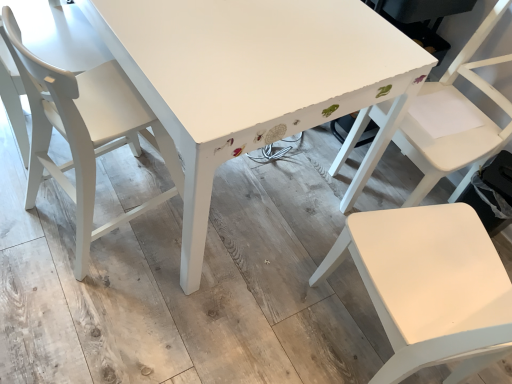
What is the approximate height of white painted wood table at center?

It is 30.33 inches.

Measure the distance between point (42, 66) and camera.

Point (42, 66) is 1.02 meters away from camera.

What do you see at coordinates (85, 130) in the screenshot?
I see `matte white chair at left, positioned as the third chair in right-to-left order` at bounding box center [85, 130].

This screenshot has height=384, width=512. Find the location of `white matte chair at right, the 2th chair when ordered from right to left`. white matte chair at right, the 2th chair when ordered from right to left is located at coordinates (430, 286).

Describe the element at coordinates (430, 286) in the screenshot. I see `white matte chair at right, the 2th chair when ordered from right to left` at that location.

The image size is (512, 384). I want to click on white painted wood table at center, so click(x=253, y=79).

Is point (484, 281) positioned behind point (207, 1)?

No, it is not.

Image resolution: width=512 pixels, height=384 pixels. Find the location of `chair that is the 3rd object located below the white painted wood table at center (from the image's perspective)`. chair that is the 3rd object located below the white painted wood table at center (from the image's perspective) is located at coordinates (430, 286).

Is white matte chair at right, the 2th chair when ordered from right to left, inside or outside of white painted wood table at center?

white matte chair at right, the 2th chair when ordered from right to left, exists outside the volume of white painted wood table at center.

From a real-world perspective, between white matte chair at right, the 2th chair when ordered from right to left, and white painted wood table at center, who is vertically lower?

From a 3D spatial view, white painted wood table at center is below.

From a real-world perspective, which is physically above, matte white chair at left, positioned as the third chair in right-to-left order, or white matte chair at right, marked as the 2th chair in a left-to-right arrangement?

In real-world perspective, white matte chair at right, marked as the 2th chair in a left-to-right arrangement, is above.

Choose the correct answer: Is matte white chair at left, positioned as the third chair in right-to-left order, inside white matte chair at right, marked as the 2th chair in a left-to-right arrangement, or outside it?

matte white chair at left, positioned as the third chair in right-to-left order, is located beyond the bounds of white matte chair at right, marked as the 2th chair in a left-to-right arrangement.

Is matte white chair at left, which is the 1th chair from left to right, in front of or behind white matte chair at right, marked as the 2th chair in a left-to-right arrangement, in the image?

In the image, matte white chair at left, which is the 1th chair from left to right, appears behind white matte chair at right, marked as the 2th chair in a left-to-right arrangement.

Which of these two, matte white chair at left, which is the 1th chair from left to right, or white matte chair at right, the 2th chair when ordered from right to left, is wider?

With larger width is white matte chair at right, the 2th chair when ordered from right to left.

Is white painted wood table at center wider than white matte chair at right, the 2th chair when ordered from right to left?

Correct, the width of white painted wood table at center exceeds that of white matte chair at right, the 2th chair when ordered from right to left.

Is white painted wood table at center oriented towards white matte chair at right, marked as the 2th chair in a left-to-right arrangement?

No, white painted wood table at center is not facing towards white matte chair at right, marked as the 2th chair in a left-to-right arrangement.

Considering the positions of objects white painted wood table at center and white matte chair at right, the 2th chair when ordered from right to left, in the image provided, who is more to the right, white painted wood table at center or white matte chair at right, the 2th chair when ordered from right to left,?

white matte chair at right, the 2th chair when ordered from right to left.

Is white matte chair at right, marked as the 2th chair in a left-to-right arrangement, surrounded by white painted wood table at center?

No, white matte chair at right, marked as the 2th chair in a left-to-right arrangement, is not surrounded by white painted wood table at center.

Considering the relative sizes of white matte chair at center, which is counted as the 3th chair, starting from the left, and white matte chair at right, marked as the 2th chair in a left-to-right arrangement, in the image provided, is white matte chair at center, which is counted as the 3th chair, starting from the left, wider than white matte chair at right, marked as the 2th chair in a left-to-right arrangement,?

No, white matte chair at center, which is counted as the 3th chair, starting from the left, is not wider than white matte chair at right, marked as the 2th chair in a left-to-right arrangement.

Does point (481, 121) appear closer or farther from the camera than point (371, 213)?

Point (481, 121) appears to be farther away from the viewer than point (371, 213).

What's the angular difference between white matte chair at center, the 1th chair when ordered from right to left, and white matte chair at right, marked as the 2th chair in a left-to-right arrangement,'s facing directions?

white matte chair at center, the 1th chair when ordered from right to left, and white matte chair at right, marked as the 2th chair in a left-to-right arrangement, are facing 106 degrees away from each other.

Does white matte chair at center, the 1th chair when ordered from right to left, appear on the left side of white matte chair at right, the 2th chair when ordered from right to left?

In fact, white matte chair at center, the 1th chair when ordered from right to left, is to the right of white matte chair at right, the 2th chair when ordered from right to left.

Is matte white chair at left, positioned as the third chair in right-to-left order, to the right of white painted wood table at center from the viewer's perspective?

Incorrect, matte white chair at left, positioned as the third chair in right-to-left order, is not on the right side of white painted wood table at center.

From a real-world perspective, between matte white chair at left, which is the 1th chair from left to right, and white painted wood table at center, who is vertically higher?

matte white chair at left, which is the 1th chair from left to right, is physically above.

Can we say matte white chair at left, which is the 1th chair from left to right, lies outside white painted wood table at center?

No, matte white chair at left, which is the 1th chair from left to right, is not outside of white painted wood table at center.

Does matte white chair at left, which is the 1th chair from left to right, have a lesser height compared to white painted wood table at center?

No.

Is white matte chair at center, the 1th chair when ordered from right to left, located outside matte white chair at left, which is the 1th chair from left to right?

Yes, white matte chair at center, the 1th chair when ordered from right to left, is outside of matte white chair at left, which is the 1th chair from left to right.

Based on the photo, is white matte chair at center, which is counted as the 3th chair, starting from the left, to the right of matte white chair at left, positioned as the third chair in right-to-left order, from the viewer's perspective?

Yes.

Is white matte chair at center, the 1th chair when ordered from right to left, facing away from matte white chair at left, positioned as the third chair in right-to-left order?

No, white matte chair at center, the 1th chair when ordered from right to left, is not facing away from matte white chair at left, positioned as the third chair in right-to-left order.

From the image's perspective, which is below, white matte chair at center, which is counted as the 3th chair, starting from the left, or matte white chair at left, which is the 1th chair from left to right?

matte white chair at left, which is the 1th chair from left to right, from the image's perspective.

Considering the points (332, 118) and (14, 52), which point is in front, point (332, 118) or point (14, 52)?

The point (14, 52) is closer to the camera.

Which object is positioned more to the right, white painted wood table at center or matte white chair at left, positioned as the third chair in right-to-left order?

white painted wood table at center.

Is matte white chair at left, positioned as the third chair in right-to-left order, surrounded by white painted wood table at center?

Yes, matte white chair at left, positioned as the third chair in right-to-left order, is surrounded by white painted wood table at center.

From a real-world perspective, is white painted wood table at center physically above matte white chair at left, which is the 1th chair from left to right?

Incorrect, from a real-world perspective, white painted wood table at center is lower than matte white chair at left, which is the 1th chair from left to right.

Identify the location of chair that is the 3rd one when counting downward from the white painted wood table at center (from the image's perspective). This screenshot has width=512, height=384. (430, 286).

The height and width of the screenshot is (384, 512). Find the location of `the 2nd chair positioned above the matte white chair at left, which is the 1th chair from left to right (from a real-world perspective)`. the 2nd chair positioned above the matte white chair at left, which is the 1th chair from left to right (from a real-world perspective) is located at coordinates (430, 286).

When comparing their distances from white painted wood table at center, does white matte chair at right, the 2th chair when ordered from right to left, or matte white chair at left, positioned as the third chair in right-to-left order, seem further?

white matte chair at right, the 2th chair when ordered from right to left, is further to white painted wood table at center.

From the image, which object appears to be farther from white painted wood table at center, white matte chair at center, which is counted as the 3th chair, starting from the left, or matte white chair at left, positioned as the third chair in right-to-left order?

white matte chair at center, which is counted as the 3th chair, starting from the left, is further to white painted wood table at center.

Which object lies further to the anchor point white matte chair at center, which is counted as the 3th chair, starting from the left, white matte chair at right, the 2th chair when ordered from right to left, or white painted wood table at center?

The object further to white matte chair at center, which is counted as the 3th chair, starting from the left, is white matte chair at right, the 2th chair when ordered from right to left.

Which object lies nearer to the anchor point matte white chair at left, positioned as the third chair in right-to-left order, white matte chair at right, the 2th chair when ordered from right to left, or white matte chair at center, which is counted as the 3th chair, starting from the left?

Based on the image, white matte chair at right, the 2th chair when ordered from right to left, appears to be nearer to matte white chair at left, positioned as the third chair in right-to-left order.

Considering their positions, is white painted wood table at center positioned further to white matte chair at right, marked as the 2th chair in a left-to-right arrangement, than matte white chair at left, which is the 1th chair from left to right?

Among the two, matte white chair at left, which is the 1th chair from left to right, is located further to white matte chair at right, marked as the 2th chair in a left-to-right arrangement.

Estimate the real-world distances between objects in this image. Which object is further from matte white chair at left, positioned as the third chair in right-to-left order, white matte chair at right, marked as the 2th chair in a left-to-right arrangement, or white painted wood table at center?

white matte chair at right, marked as the 2th chair in a left-to-right arrangement, lies further to matte white chair at left, positioned as the third chair in right-to-left order, than the other object.

Considering their positions, is white painted wood table at center positioned closer to matte white chair at left, which is the 1th chair from left to right, than white matte chair at right, the 2th chair when ordered from right to left?

Among the two, white painted wood table at center is located nearer to matte white chair at left, which is the 1th chair from left to right.

Estimate the real-world distances between objects in this image. Which object is closer to white matte chair at right, marked as the 2th chair in a left-to-right arrangement, white matte chair at center, which is counted as the 3th chair, starting from the left, or white painted wood table at center?

white matte chair at center, which is counted as the 3th chair, starting from the left, is positioned closer to the anchor white matte chair at right, marked as the 2th chair in a left-to-right arrangement.

Identify the location of table located between matte white chair at left, which is the 1th chair from left to right, and white matte chair at center, the 1th chair when ordered from right to left, in the left-right direction. (253, 79).

This screenshot has width=512, height=384. Identify the location of chair between matte white chair at left, positioned as the third chair in right-to-left order, and white matte chair at center, which is counted as the 3th chair, starting from the left, from left to right. (430, 286).

The width and height of the screenshot is (512, 384). What are the coordinates of `table located between matte white chair at left, which is the 1th chair from left to right, and white matte chair at right, marked as the 2th chair in a left-to-right arrangement, in the left-right direction` in the screenshot? It's located at (253, 79).

Where is `chair located between white painted wood table at center and white matte chair at center, the 1th chair when ordered from right to left, in the left-right direction`? The image size is (512, 384). chair located between white painted wood table at center and white matte chair at center, the 1th chair when ordered from right to left, in the left-right direction is located at coordinates (430, 286).